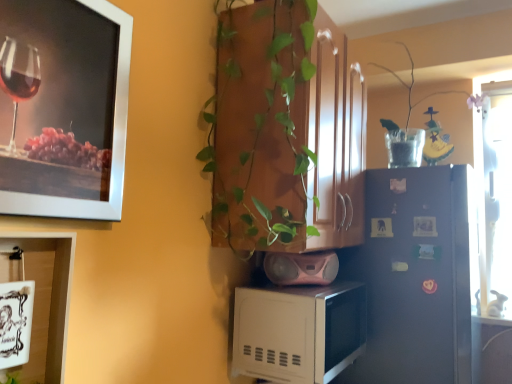
Question: Considering the relative positions of green glossy plant at center and white glossy cabinet at lower left in the image provided, is green glossy plant at center to the left of white glossy cabinet at lower left from the viewer's perspective?

Choices:
 (A) yes
 (B) no

Answer: (B)

Question: Can we say green glossy plant at center lies outside white glossy cabinet at lower left?

Choices:
 (A) yes
 (B) no

Answer: (A)

Question: From a real-world perspective, is green glossy plant at center physically above white glossy cabinet at lower left?

Choices:
 (A) no
 (B) yes

Answer: (B)

Question: Is white glossy cabinet at lower left located within green glossy plant at center?

Choices:
 (A) yes
 (B) no

Answer: (B)

Question: Is green glossy plant at center bigger than white glossy cabinet at lower left?

Choices:
 (A) no
 (B) yes

Answer: (B)

Question: Does green glossy plant at center have a greater height compared to white glossy cabinet at lower left?

Choices:
 (A) yes
 (B) no

Answer: (A)

Question: Is metallic silver picture frame at upper left, the 2th picture frame from the bottom, positioned behind clear glass vase at upper right?

Choices:
 (A) yes
 (B) no

Answer: (B)

Question: Considering the relative sizes of metallic silver picture frame at upper left, the 2th picture frame from the bottom, and clear glass vase at upper right in the image provided, is metallic silver picture frame at upper left, the 2th picture frame from the bottom, thinner than clear glass vase at upper right?

Choices:
 (A) no
 (B) yes

Answer: (B)

Question: From a real-world perspective, is metallic silver picture frame at upper left, the 2th picture frame from the bottom, under clear glass vase at upper right?

Choices:
 (A) no
 (B) yes

Answer: (B)

Question: Is metallic silver picture frame at upper left, arranged as the first picture frame when viewed from the top, taller than clear glass vase at upper right?

Choices:
 (A) no
 (B) yes

Answer: (B)

Question: Is metallic silver picture frame at upper left, arranged as the first picture frame when viewed from the top, not close to clear glass vase at upper right?

Choices:
 (A) no
 (B) yes

Answer: (B)

Question: Considering the relative positions of metallic silver picture frame at upper left, arranged as the first picture frame when viewed from the top, and clear glass vase at upper right in the image provided, is metallic silver picture frame at upper left, arranged as the first picture frame when viewed from the top, to the left of clear glass vase at upper right from the viewer's perspective?

Choices:
 (A) no
 (B) yes

Answer: (B)

Question: Is metallic silver picture frame at upper left, the 2th picture frame from the bottom, facing away from white glossy cabinet at lower left?

Choices:
 (A) yes
 (B) no

Answer: (B)